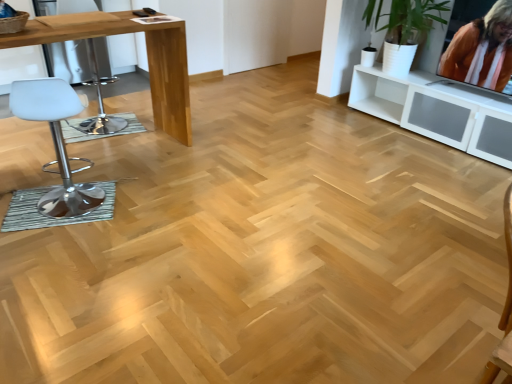
I want to click on free location in front of light brown glossy table at left, so click(x=104, y=244).